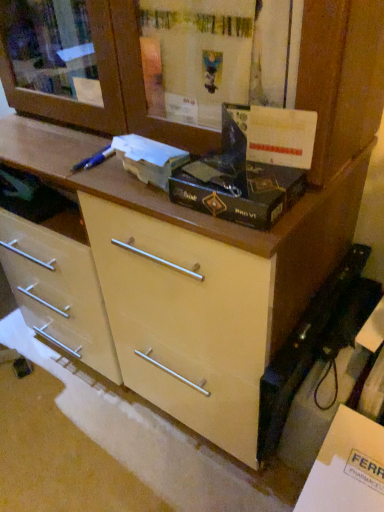
Locate an element on the screen. This screenshot has height=512, width=384. white cardboard box at center, acting as the first box starting from the left is located at coordinates (149, 159).

This screenshot has height=512, width=384. In order to click on white matte cabinet at lower right in this screenshot , I will do `click(347, 468)`.

This screenshot has height=512, width=384. I want to click on black matte box at center, arranged as the 2th box when viewed from the left, so click(238, 191).

What are the coordinates of `white cardboard box at center, acting as the first box starting from the left` in the screenshot? It's located at (149, 159).

Looking at their sizes, would you say white matte cabinet at lower right is wider or thinner than white cardboard box at center, acting as the first box starting from the left?

white matte cabinet at lower right is wider than white cardboard box at center, acting as the first box starting from the left.

Is white matte cabinet at lower right smaller than white cardboard box at center, which appears as the second box when viewed from the right?

Actually, white matte cabinet at lower right might be larger than white cardboard box at center, which appears as the second box when viewed from the right.

From a real-world perspective, is white matte cabinet at lower right under white cardboard box at center, which appears as the second box when viewed from the right?

Yes, from a real-world perspective, white matte cabinet at lower right is beneath white cardboard box at center, which appears as the second box when viewed from the right.

This screenshot has width=384, height=512. In order to click on box that is the 2nd object to the left of the white matte cabinet at lower right, starting at the anchor in this screenshot , I will do `click(149, 159)`.

What's the angular difference between white matte cabinet at lower right and black matte box at center, which ranks as the 1th box in right-to-left order,'s facing directions?

They differ by 1.25 degrees in their facing directions.

Find the location of a particular element. This screenshot has height=512, width=384. box that is the 1st object to the left of the white matte cabinet at lower right, starting at the anchor is located at coordinates (238, 191).

Is point (349, 445) closer to camera compared to point (245, 174)?

No.

In terms of width, does white matte cabinet at lower right look wider or thinner when compared to black matte box at center, which ranks as the 1th box in right-to-left order?

Considering their sizes, white matte cabinet at lower right looks broader than black matte box at center, which ranks as the 1th box in right-to-left order.

Measure the distance from black matte box at center, arranged as the 2th box when viewed from the left, to white cardboard box at center, which appears as the second box when viewed from the right.

A distance of 4.30 inches exists between black matte box at center, arranged as the 2th box when viewed from the left, and white cardboard box at center, which appears as the second box when viewed from the right.

Considering the points (234, 199) and (129, 149), which point is in front, point (234, 199) or point (129, 149)?

The point (234, 199) is closer.

Is black matte box at center, arranged as the 2th box when viewed from the left, positioned far away from white cardboard box at center, acting as the first box starting from the left?

black matte box at center, arranged as the 2th box when viewed from the left, is near white cardboard box at center, acting as the first box starting from the left, not far away.

From the picture: Is black matte box at center, arranged as the 2th box when viewed from the left, aimed at white cardboard box at center, which appears as the second box when viewed from the right?

No.

Would you consider white cardboard box at center, acting as the first box starting from the left, to be distant from black matte box at center, which ranks as the 1th box in right-to-left order?

No.

In the scene shown: From a real-world perspective, who is located lower, white cardboard box at center, which appears as the second box when viewed from the right, or black matte box at center, arranged as the 2th box when viewed from the left?

black matte box at center, arranged as the 2th box when viewed from the left, is physically lower.

Based on their sizes in the image, would you say white cardboard box at center, which appears as the second box when viewed from the right, is bigger or smaller than black matte box at center, arranged as the 2th box when viewed from the left?

white cardboard box at center, which appears as the second box when viewed from the right, is smaller than black matte box at center, arranged as the 2th box when viewed from the left.

Is white cardboard box at center, acting as the first box starting from the left, positioned before black matte box at center, arranged as the 2th box when viewed from the left?

No, white cardboard box at center, acting as the first box starting from the left, is behind black matte box at center, arranged as the 2th box when viewed from the left.

Is black matte box at center, arranged as the 2th box when viewed from the left, turned away from white matte cabinet at lower right?

black matte box at center, arranged as the 2th box when viewed from the left, does not have its back to white matte cabinet at lower right.

From the image's perspective, who appears lower, black matte box at center, arranged as the 2th box when viewed from the left, or white matte cabinet at lower right?

white matte cabinet at lower right appears lower in the image.

Considering the sizes of black matte box at center, arranged as the 2th box when viewed from the left, and white matte cabinet at lower right in the image, is black matte box at center, arranged as the 2th box when viewed from the left, bigger or smaller than white matte cabinet at lower right?

Clearly, black matte box at center, arranged as the 2th box when viewed from the left, is smaller in size than white matte cabinet at lower right.

Is white cardboard box at center, which appears as the second box when viewed from the right, shorter than white matte cabinet at lower right?

Indeed, white cardboard box at center, which appears as the second box when viewed from the right, has a lesser height compared to white matte cabinet at lower right.

Where is `cabinetry below the white cardboard box at center, which appears as the second box when viewed from the right (from the image's perspective)`? The image size is (384, 512). cabinetry below the white cardboard box at center, which appears as the second box when viewed from the right (from the image's perspective) is located at coordinates (347, 468).

Is white cardboard box at center, acting as the first box starting from the left, oriented towards white matte cabinet at lower right?

No, white cardboard box at center, acting as the first box starting from the left, does not turn towards white matte cabinet at lower right.

Is white cardboard box at center, which appears as the second box when viewed from the right, wider or thinner than white matte cabinet at lower right?

Considering their sizes, white cardboard box at center, which appears as the second box when viewed from the right, looks slimmer than white matte cabinet at lower right.

From a real-world perspective, which box is the 2nd one above the white matte cabinet at lower right? Please provide its 2D coordinates.

[(149, 159)]

This screenshot has width=384, height=512. I want to click on box that is in front of the white matte cabinet at lower right, so point(238,191).

Based on their spatial positions, is black matte box at center, arranged as the 2th box when viewed from the left, or white cardboard box at center, which appears as the second box when viewed from the right, further from white matte cabinet at lower right?

Among the two, white cardboard box at center, which appears as the second box when viewed from the right, is located further to white matte cabinet at lower right.

When comparing their distances from white cardboard box at center, acting as the first box starting from the left, does black matte box at center, which ranks as the 1th box in right-to-left order, or white matte cabinet at lower right seem closer?

black matte box at center, which ranks as the 1th box in right-to-left order, is positioned closer to the anchor white cardboard box at center, acting as the first box starting from the left.

Looking at the image, which one is located further to black matte box at center, arranged as the 2th box when viewed from the left, white cardboard box at center, acting as the first box starting from the left, or white matte cabinet at lower right?

The object further to black matte box at center, arranged as the 2th box when viewed from the left, is white matte cabinet at lower right.

Considering their positions, is white matte cabinet at lower right positioned closer to black matte box at center, which ranks as the 1th box in right-to-left order, than white cardboard box at center, which appears as the second box when viewed from the right?

Based on the image, white cardboard box at center, which appears as the second box when viewed from the right, appears to be nearer to black matte box at center, which ranks as the 1th box in right-to-left order.

Which object lies further to the anchor point white cardboard box at center, acting as the first box starting from the left, white matte cabinet at lower right or black matte box at center, which ranks as the 1th box in right-to-left order?

white matte cabinet at lower right is positioned further to the anchor white cardboard box at center, acting as the first box starting from the left.

Which object lies further to the anchor point white matte cabinet at lower right, white cardboard box at center, which appears as the second box when viewed from the right, or black matte box at center, arranged as the 2th box when viewed from the left?

Based on the image, white cardboard box at center, which appears as the second box when viewed from the right, appears to be further to white matte cabinet at lower right.

Identify the location of box between white cardboard box at center, which appears as the second box when viewed from the right, and white matte cabinet at lower right from top to bottom. The width and height of the screenshot is (384, 512). (238, 191).